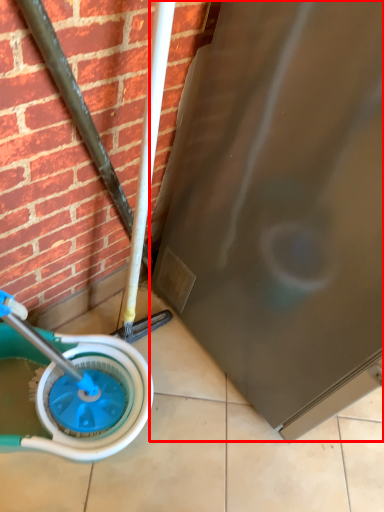
Question: From the image's perspective, what is the correct spatial positioning of screen door (annotated by the red box) in reference to wheel?

Choices:
 (A) above
 (B) below

Answer: (A)